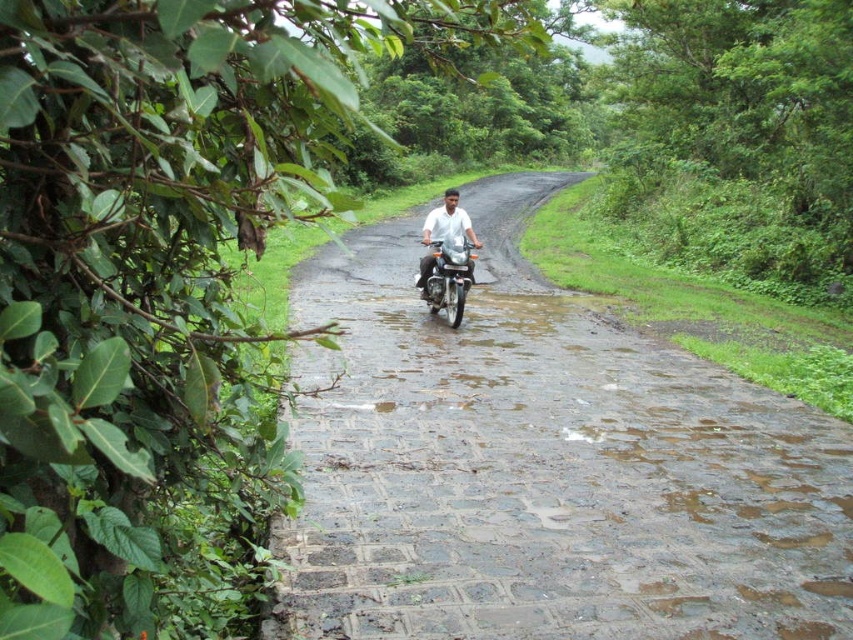
Does metallic silver motorcycle at center have a lesser width compared to white matte shirt at center?

Correct, metallic silver motorcycle at center's width is less than white matte shirt at center's.

Does metallic silver motorcycle at center have a greater height compared to white matte shirt at center?

Incorrect, metallic silver motorcycle at center's height is not larger of white matte shirt at center's.

Between point (438, 269) and point (476, 243), which one is positioned behind?

Positioned behind is point (438, 269).

At what (x,y) coordinates should I click in order to perform the action: click on metallic silver motorcycle at center. Please return your answer as a coordinate pair (x, y). The image size is (853, 640). Looking at the image, I should click on (448, 276).

Between point (281, 618) and point (456, 317), which one is positioned behind?

The point (456, 317) is behind.

Is point (750, 428) behind point (474, 244)?

No, it is not.

The height and width of the screenshot is (640, 853). In order to click on paved stone road at center in this screenshot , I will do `click(543, 465)`.

Does paved stone road at center have a lesser height compared to white matte shirt at center?

Indeed, paved stone road at center has a lesser height compared to white matte shirt at center.

Image resolution: width=853 pixels, height=640 pixels. What do you see at coordinates (543, 465) in the screenshot? I see `paved stone road at center` at bounding box center [543, 465].

Where is `paved stone road at center`? The image size is (853, 640). paved stone road at center is located at coordinates (543, 465).

Find the location of a particular element. This screenshot has height=640, width=853. paved stone road at center is located at coordinates (543, 465).